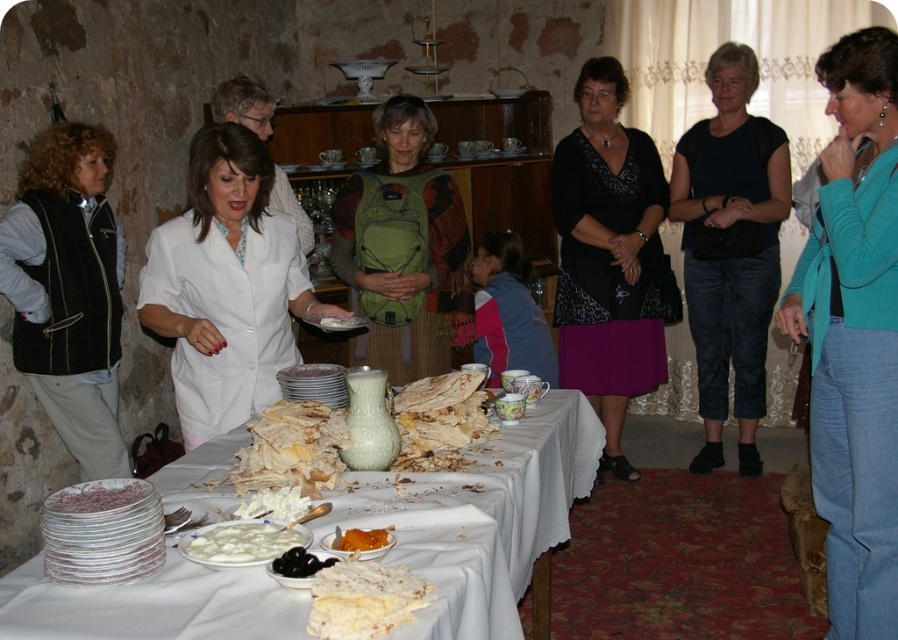
You are a guest at this event and want to place your crumbly golden pancake at center onto your black cotton shirt at center without it touching the table. Is this possible based on their sizes?

The black cotton shirt at center has a larger size compared to crumbly golden pancake at center, so yes, the crumbly golden pancake at center can be placed on the black cotton shirt at center without touching the table since the shirt is bigger.

You are a server at the event and need to place a new dish on the table. You have a black cotton shirt at center and a crumbly golden pancake at center on the table. Which item do you need to move to make space for the dish?

The black cotton shirt at center might be wider than crumbly golden pancake at center, so moving the black cotton shirt at center would provide more space for the new dish.

You are a guest at the event and want to grab a piece of the crumbly white cake at center. However, there is a black vest at left in your way. Can you reach the cake without moving the vest?

The black vest at left is located above the crumbly white cake at center, so you can reach the cake without moving the vest since it is below the vest.